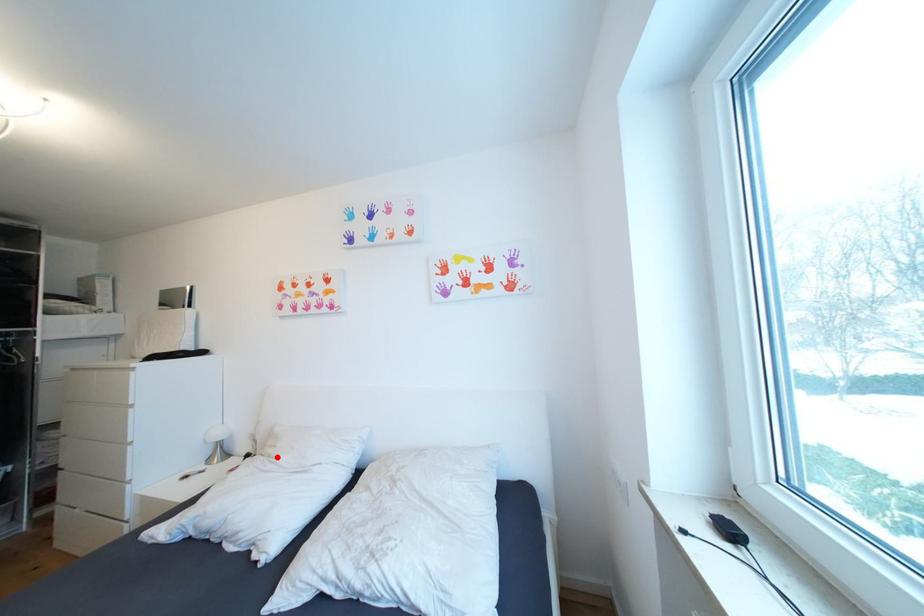
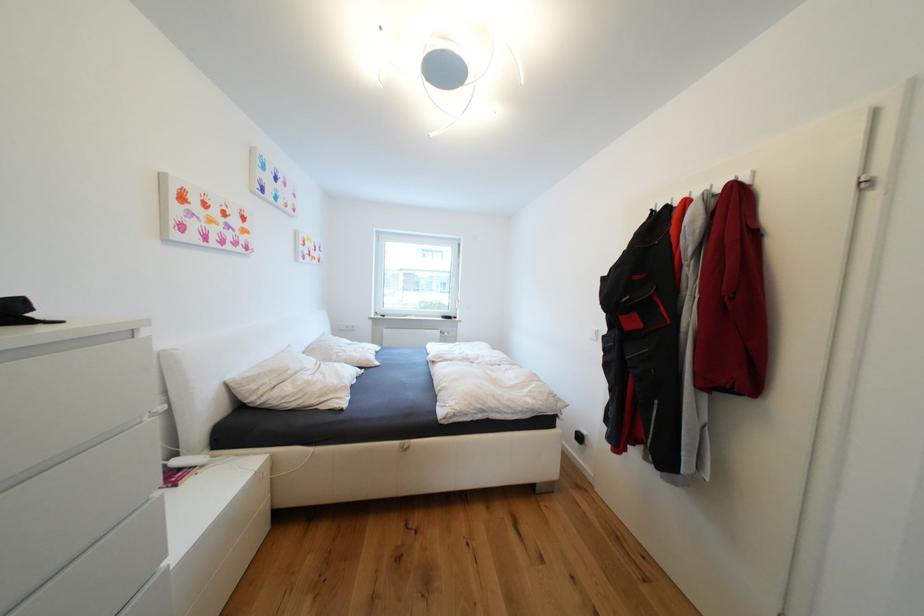
In the second image, find the point that corresponds to the highlighted location in the first image.

(304, 374)